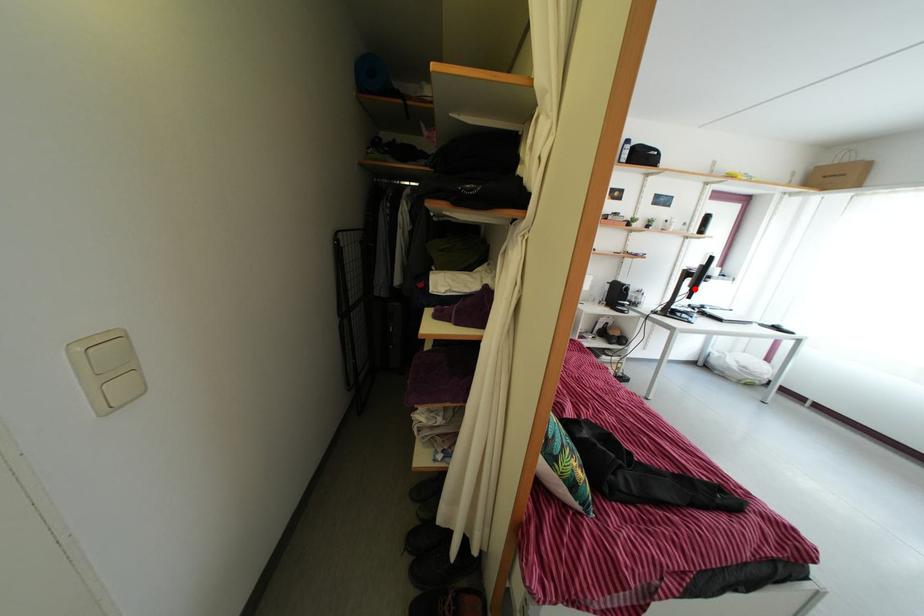
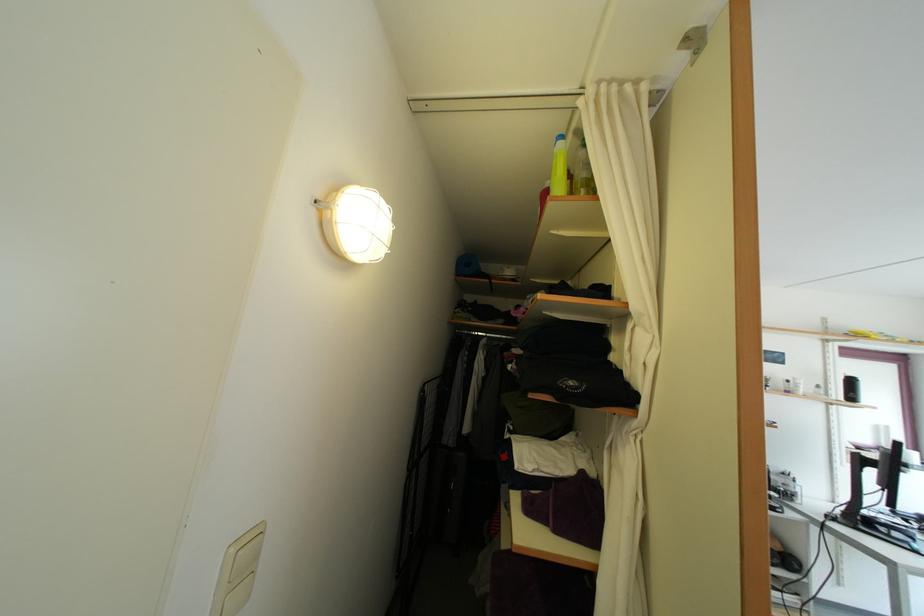
Question: I am providing you with two images of the same scene from different viewpoints. Image1 has a red point marked. In image2, the corresponding 3D location appears at what relative position? Reply with the corresponding letter.

Choices:
 (A) Closer
 (B) Farther

Answer: (A)